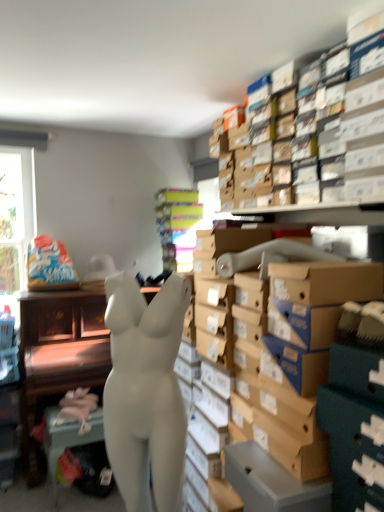
Question: Can you confirm if multicolored cardboard boxes at center is positioned to the right of white matte mannequin at center?

Choices:
 (A) yes
 (B) no

Answer: (A)

Question: Does multicolored cardboard boxes at center have a larger size compared to white matte mannequin at center?

Choices:
 (A) no
 (B) yes

Answer: (A)

Question: Are multicolored cardboard boxes at center and white matte mannequin at center beside each other?

Choices:
 (A) yes
 (B) no

Answer: (B)

Question: Considering the relative sizes of multicolored cardboard boxes at center and white matte mannequin at center in the image provided, is multicolored cardboard boxes at center thinner than white matte mannequin at center?

Choices:
 (A) yes
 (B) no

Answer: (B)

Question: Does multicolored cardboard boxes at center have a lesser height compared to white matte mannequin at center?

Choices:
 (A) no
 (B) yes

Answer: (B)

Question: From the image's perspective, is multicolored cardboard boxes at center above white matte mannequin at center?

Choices:
 (A) yes
 (B) no

Answer: (A)

Question: From the image's perspective, is white matte mannequin at center located beneath white matte mannequin at center?

Choices:
 (A) no
 (B) yes

Answer: (B)

Question: Is white matte mannequin at center next to white matte mannequin at center and touching it?

Choices:
 (A) yes
 (B) no

Answer: (B)

Question: Is white matte mannequin at center outside white matte mannequin at center?

Choices:
 (A) no
 (B) yes

Answer: (B)

Question: Is white matte mannequin at center shorter than white matte mannequin at center?

Choices:
 (A) no
 (B) yes

Answer: (A)

Question: Is white matte mannequin at center positioned before white matte mannequin at center?

Choices:
 (A) yes
 (B) no

Answer: (B)

Question: From a real-world perspective, is white matte mannequin at center located beneath white matte mannequin at center?

Choices:
 (A) no
 (B) yes

Answer: (B)

Question: Are white matte mannequin at center and multicolored cardboard boxes at center far apart?

Choices:
 (A) no
 (B) yes

Answer: (A)